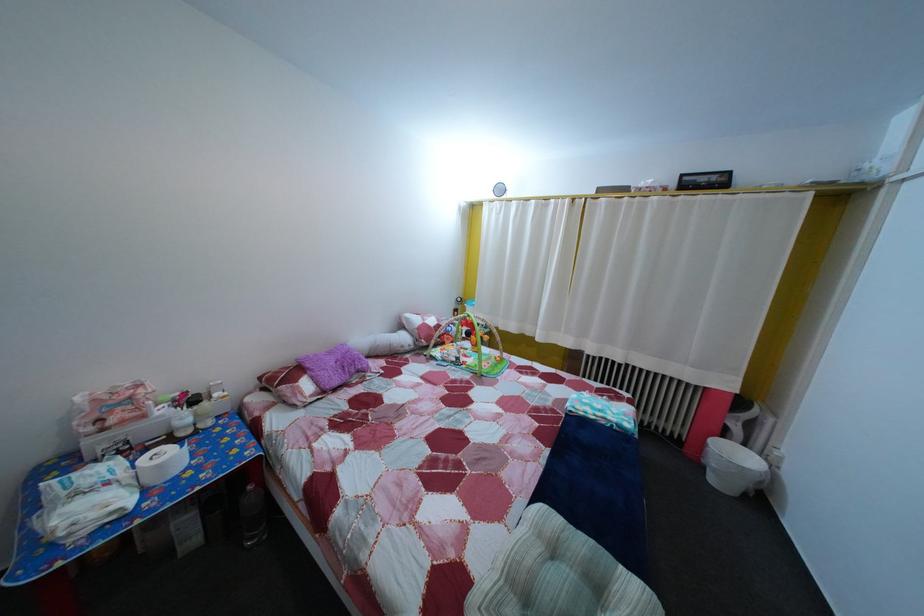
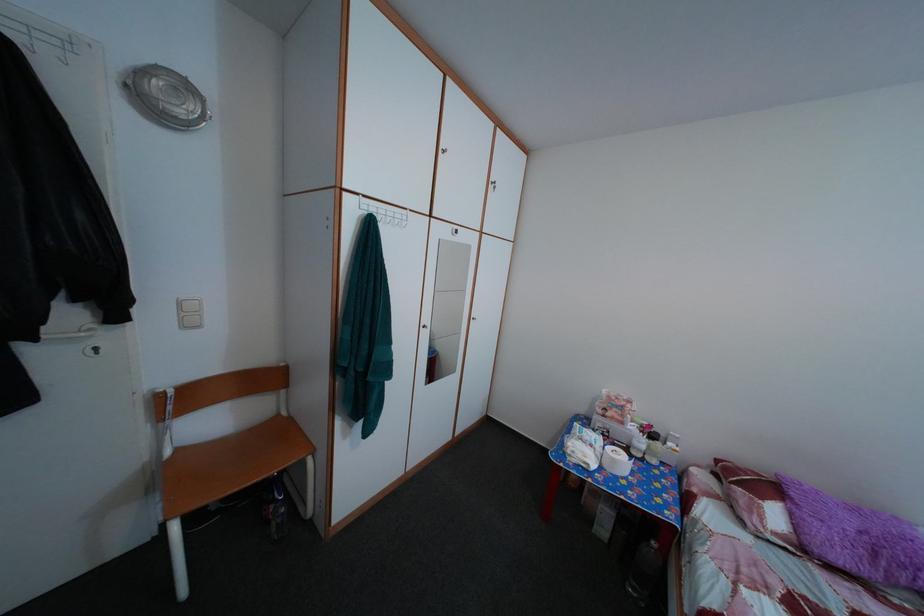
Question: The camera is either moving clockwise (left) or counter-clockwise (right) around the object. The first image is from the beginning of the video and the second image is from the end. Is the camera moving left or right when shooting the video?

Choices:
 (A) Left
 (B) Right

Answer: (B)